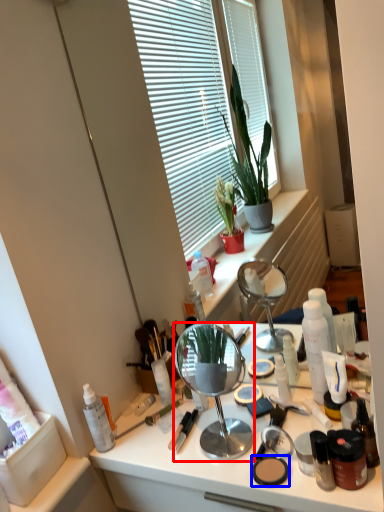
Question: Which object is further to the camera taking this photo, mirror (highlighted by a red box) or face powder (highlighted by a blue box)?

Choices:
 (A) mirror
 (B) face powder

Answer: (B)